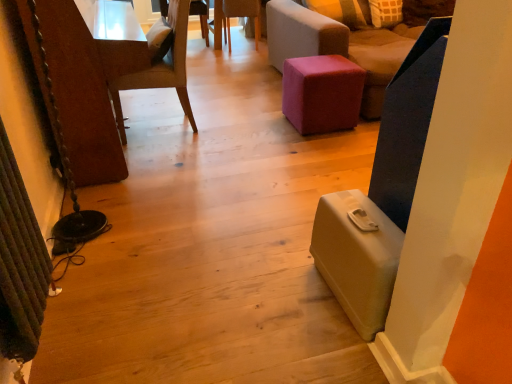
Question: Considering the positions of point (356, 259) and point (218, 36), is point (356, 259) closer or farther from the camera than point (218, 36)?

Choices:
 (A) closer
 (B) farther

Answer: (A)

Question: From a real-world perspective, relative to wooden chair at center, arranged as the second chair when viewed from the right, is matte green suitcase at lower right vertically above or below?

Choices:
 (A) below
 (B) above

Answer: (A)

Question: Which is farther from the velvet pink ottoman at center?

Choices:
 (A) wooden textured chair at upper center, which is counted as the fourth chair, starting from the right
 (B) light brown wood chair at left, positioned as the third chair in right-to-left order
 (C) wooden chair at center, arranged as the second chair when viewed from the right
 (D) matte green suitcase at lower right
 (E) purple fabric ottoman at center, the first chair when ordered from right to left

Answer: (A)

Question: Estimate the real-world distances between objects in this image. Which object is farther from the matte green suitcase at lower right?

Choices:
 (A) light brown wood chair at left, positioned as the third chair in right-to-left order
 (B) purple fabric ottoman at center, the first chair when ordered from right to left
 (C) wooden textured chair at upper center, which is counted as the fourth chair, starting from the right
 (D) wooden chair at center, acting as the third chair starting from the left
 (E) velvet pink ottoman at center

Answer: (C)